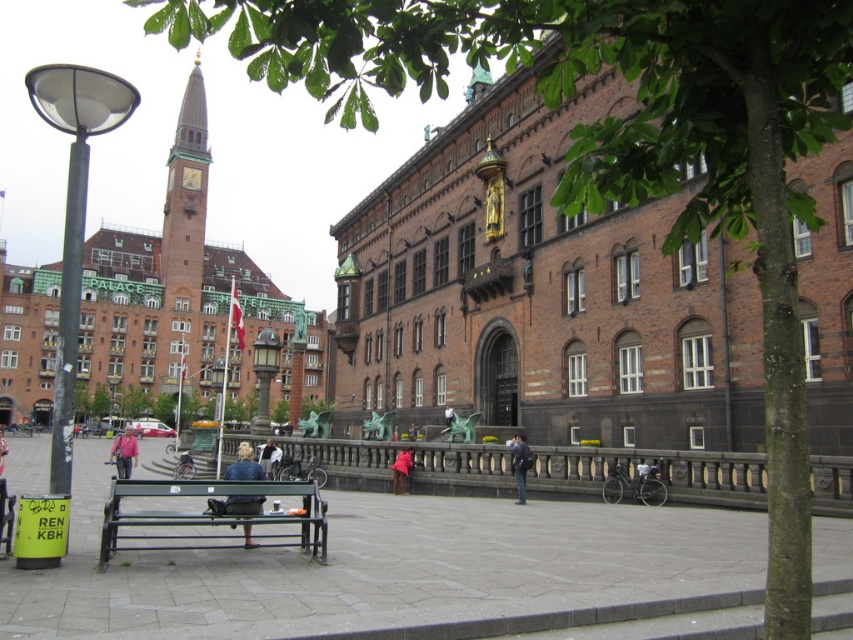
This screenshot has height=640, width=853. I want to click on matte black lamp post at left, so click(74, 216).

Can you confirm if matte black lamp post at left is shorter than dark blue jeans at center?

Incorrect, matte black lamp post at left's height does not fall short of dark blue jeans at center's.

Does point (74, 292) lie in front of point (514, 476)?

That is True.

Locate an element on the screen. The image size is (853, 640). matte black lamp post at left is located at coordinates (74, 216).

Can you confirm if pink fabric coat at center is thinner than light brown leather jacket at center?

Incorrect, pink fabric coat at center's width is not less than light brown leather jacket at center's.

Image resolution: width=853 pixels, height=640 pixels. Describe the element at coordinates (401, 468) in the screenshot. I see `pink fabric coat at center` at that location.

Image resolution: width=853 pixels, height=640 pixels. I want to click on pink fabric coat at center, so click(x=401, y=468).

Can you confirm if matte black lamp post at left is positioned above light brown leather jacket at center?

Correct, matte black lamp post at left is located above light brown leather jacket at center.

Between point (32, 92) and point (451, 410), which one is positioned behind?

Point (451, 410)

Who is more distant from viewer, (x=74, y=284) or (x=448, y=419)?

The point (x=448, y=419) is behind.

What are the coordinates of `matte black lamp post at left` in the screenshot? It's located at (74, 216).